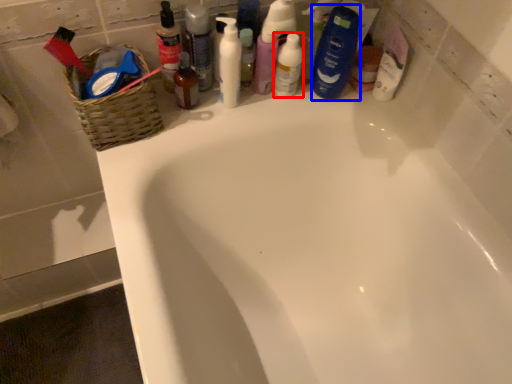
Question: Which of the following is the farthest to the observer, mouthwash (highlighted by a red box) or toiletry (highlighted by a blue box)?

Choices:
 (A) mouthwash
 (B) toiletry

Answer: (A)